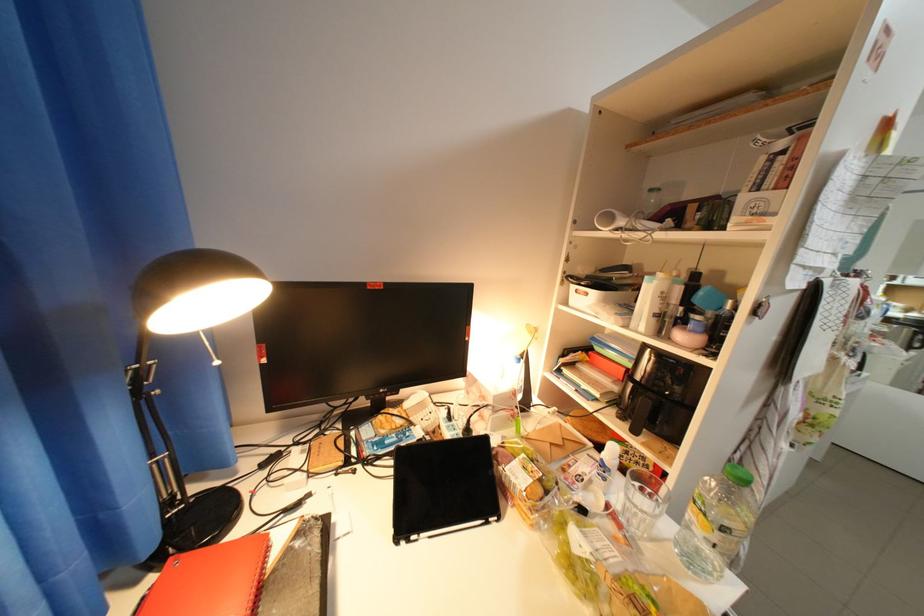
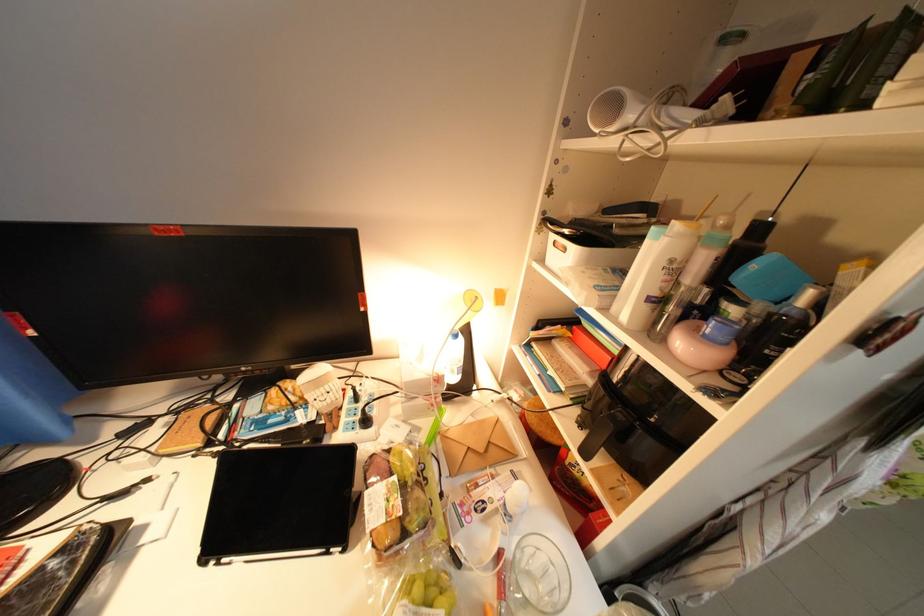
Looking at this image, what movement of the cameraman would produce the second image?

The cameraman walked toward right, forward.